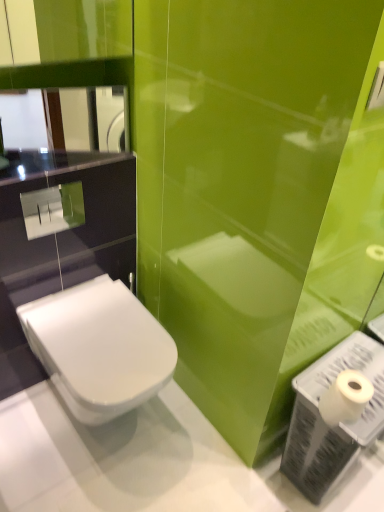
Find the location of `vacant space underneath white glossy toilet at lower left (from a real-world perspective)`. vacant space underneath white glossy toilet at lower left (from a real-world perspective) is located at coordinates (122, 433).